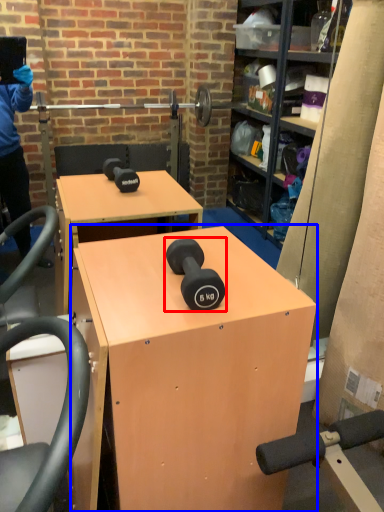
Question: Which object appears closest to the camera in this image, dumbbell (highlighted by a red box) or desk (highlighted by a blue box)?

Choices:
 (A) dumbbell
 (B) desk

Answer: (B)